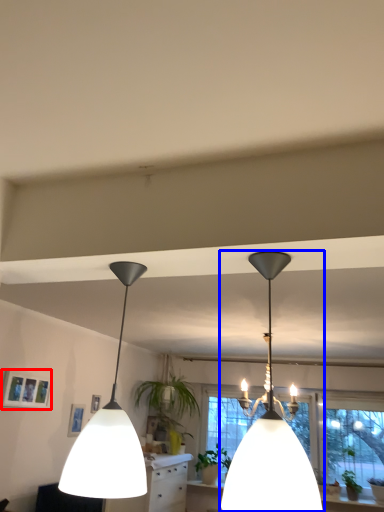
Question: Which object appears farthest to the camera in this image, picture frame (highlighted by a red box) or lamp (highlighted by a blue box)?

Choices:
 (A) picture frame
 (B) lamp

Answer: (A)